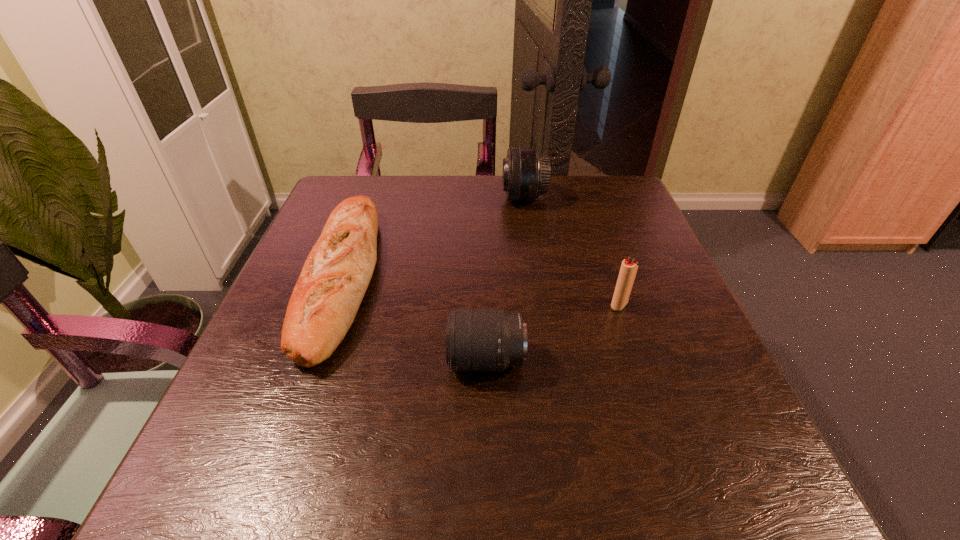
I want to click on vacant space at the left edge of the desktop, so click(x=274, y=315).

Image resolution: width=960 pixels, height=540 pixels. In the image, there is a desktop. Find the location of `vacant space at the right edge`. vacant space at the right edge is located at coordinates tap(633, 342).

In the image, there is a desktop. Identify the location of vacant space at the far left corner. (349, 193).

This screenshot has width=960, height=540. In order to click on vacant position at the near left corner of the desktop in this screenshot , I will do `click(237, 471)`.

This screenshot has height=540, width=960. What are the coordinates of `free space at the far right corner of the desktop` in the screenshot? It's located at (618, 186).

The width and height of the screenshot is (960, 540). In order to click on free space between the baguet and the nearer telephoto lens in this screenshot , I will do `click(415, 319)`.

Where is `free space between the igniter and the nearer telephoto lens`? This screenshot has width=960, height=540. free space between the igniter and the nearer telephoto lens is located at coordinates (553, 333).

This screenshot has height=540, width=960. In order to click on blank region between the taller telephoto lens and the shorter telephoto lens in this screenshot , I will do `click(505, 279)`.

Identify the location of free space between the farthest object and the igniter. (571, 252).

Locate an element on the screen. This screenshot has height=540, width=960. empty space that is in between the shorter telephoto lens and the farthest object is located at coordinates (505, 279).